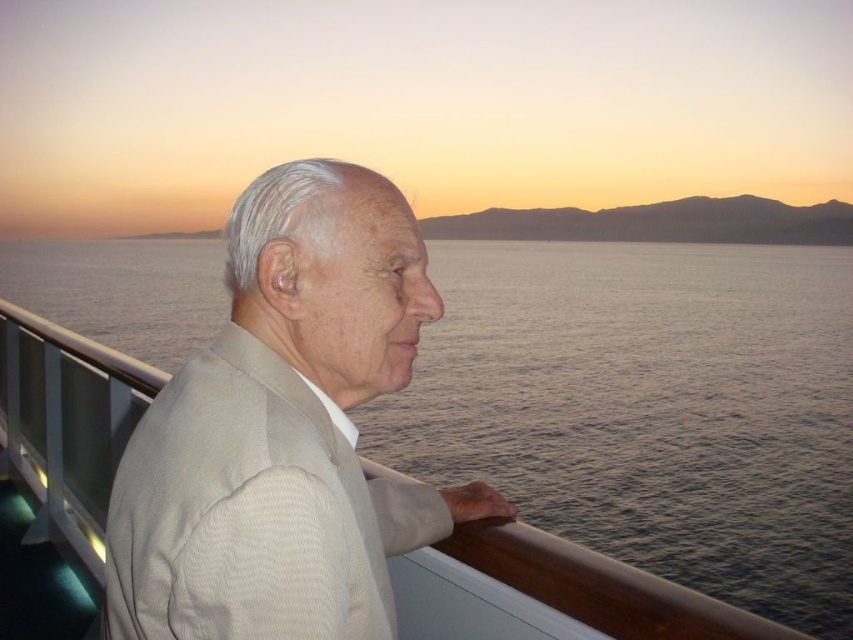
Question: Which point is closer to the camera?

Choices:
 (A) (399, 541)
 (B) (595, 365)

Answer: (A)

Question: Does gray water at left have a lesser width compared to beige textured suit at center?

Choices:
 (A) no
 (B) yes

Answer: (A)

Question: Which point appears closest to the camera in this image?

Choices:
 (A) (384, 205)
 (B) (795, 456)

Answer: (A)

Question: Can you confirm if gray water at left is positioned below beige textured suit at center?

Choices:
 (A) no
 (B) yes

Answer: (A)

Question: Does gray water at left appear on the right side of beige textured suit at center?

Choices:
 (A) no
 (B) yes

Answer: (A)

Question: Which point appears farthest from the camera in this image?

Choices:
 (A) (213, 372)
 (B) (491, 449)

Answer: (B)